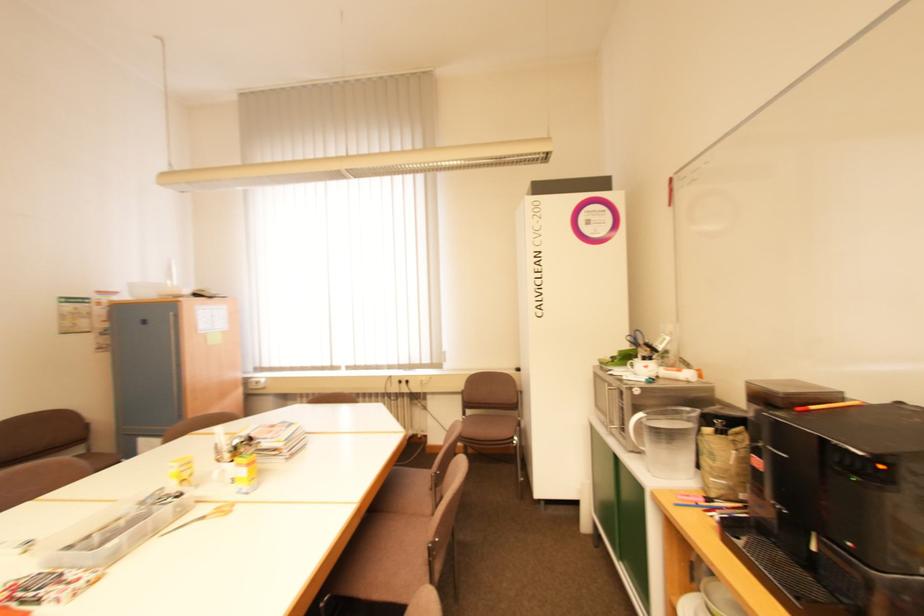
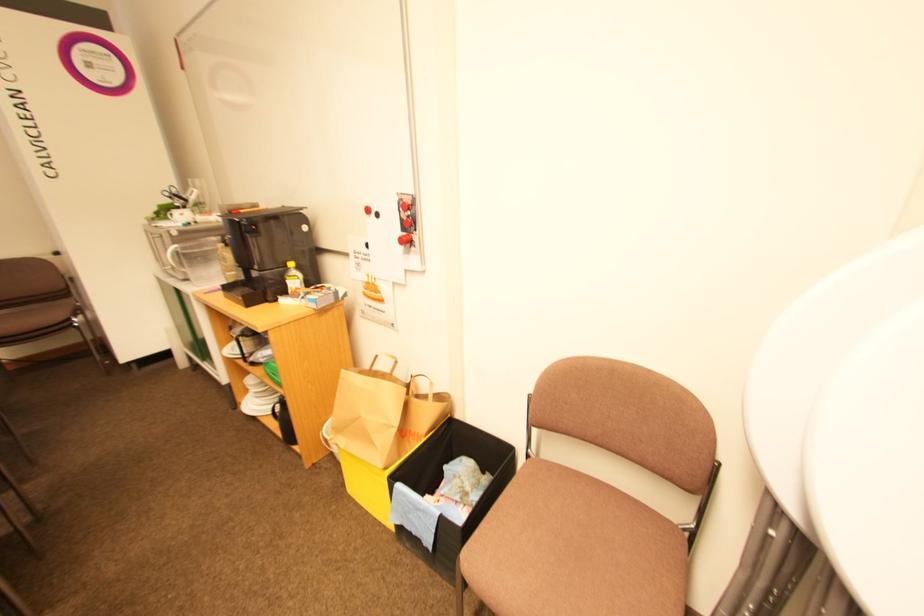
Consider the image. The first image is from the beginning of the video and the second image is from the end. How did the camera likely rotate when shooting the video?

The camera's rotation is toward right-down.